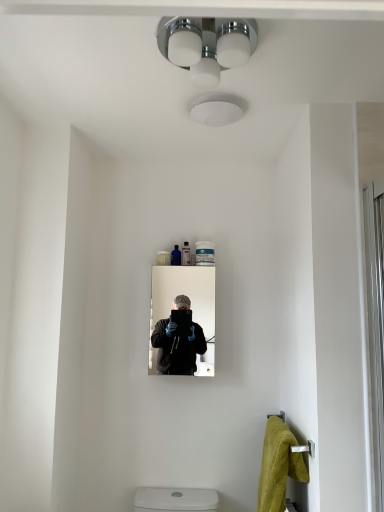
What do you see at coordinates (375, 329) in the screenshot? Image resolution: width=384 pixels, height=512 pixels. I see `white glossy screen door at right` at bounding box center [375, 329].

Find the location of `white glossy screen door at right`. white glossy screen door at right is located at coordinates (375, 329).

Measure the distance between point (295,443) and camera.

5.09 feet.

You are a GUI agent. You are given a task and a screenshot of the screen. Output one action in this format:
    pyautogui.click(x=<x>, y=<y>)
    Task: Click on the chrome/textured glass light fixture at upper center
    The width and height of the screenshot is (384, 512).
    Given the screenshot: What is the action you would take?
    coord(209,44)

The width and height of the screenshot is (384, 512). Identify the location of white glossy screen door at right. coord(375,329).

From a real-world perspective, is chrome/textured glass light fixture at upper center physically above yellow plush towel at lower right?

Result: Correct, in the physical world, chrome/textured glass light fixture at upper center is higher than yellow plush towel at lower right.

Would you consider chrome/textured glass light fixture at upper center to be distant from yellow plush towel at lower right?

That's right, there is a large distance between chrome/textured glass light fixture at upper center and yellow plush towel at lower right.

Considering the relative positions of chrome/textured glass light fixture at upper center and yellow plush towel at lower right in the image provided, is chrome/textured glass light fixture at upper center in front of yellow plush towel at lower right?

Yes, the depth of chrome/textured glass light fixture at upper center is less than that of yellow plush towel at lower right.

Considering the sizes of chrome/textured glass light fixture at upper center and yellow plush towel at lower right in the image, is chrome/textured glass light fixture at upper center bigger or smaller than yellow plush towel at lower right?

Clearly, chrome/textured glass light fixture at upper center is smaller in size than yellow plush towel at lower right.

Considering the relative sizes of translucent blue bottle at upper center, which appears as the 1th toiletry when viewed from the left, and yellow plush towel at lower right in the image provided, is translucent blue bottle at upper center, which appears as the 1th toiletry when viewed from the left, smaller than yellow plush towel at lower right?

Indeed, translucent blue bottle at upper center, which appears as the 1th toiletry when viewed from the left, has a smaller size compared to yellow plush towel at lower right.

From their relative heights in the image, would you say translucent blue bottle at upper center, the 2th toiletry positioned from the right, is taller or shorter than yellow plush towel at lower right?

In the image, translucent blue bottle at upper center, the 2th toiletry positioned from the right, appears to be shorter than yellow plush towel at lower right.

How many degrees apart are the facing directions of translucent blue bottle at upper center, the 2th toiletry positioned from the right, and yellow plush towel at lower right?

The facing directions of translucent blue bottle at upper center, the 2th toiletry positioned from the right, and yellow plush towel at lower right are 90.5 degrees apart.

Does translucent blue bottle at upper center, the 2th toiletry positioned from the right, come in front of yellow plush towel at lower right?

That is False.

Is translucent blue bottle at upper center, the 2th toiletry positioned from the right, positioned behind matte black mirror at center?

Yes, it is behind matte black mirror at center.

Considering the sizes of objects translucent blue bottle at upper center, the 2th toiletry positioned from the right, and matte black mirror at center in the image provided, who is taller, translucent blue bottle at upper center, the 2th toiletry positioned from the right, or matte black mirror at center?

Standing taller between the two is matte black mirror at center.

Considering the sizes of objects translucent blue bottle at upper center, which appears as the 1th toiletry when viewed from the left, and matte black mirror at center in the image provided, who is thinner, translucent blue bottle at upper center, which appears as the 1th toiletry when viewed from the left, or matte black mirror at center?

translucent blue bottle at upper center, which appears as the 1th toiletry when viewed from the left, is thinner.

Does translucent blue bottle at upper center, which appears as the 1th toiletry when viewed from the left, turn towards matte black mirror at center?

No, translucent blue bottle at upper center, which appears as the 1th toiletry when viewed from the left, is not oriented towards matte black mirror at center.

Between translucent blue bottle at upper center, which appears as the 1th toiletry when viewed from the left, and translucent plastic tube at center, the first toiletry from the right, which one has less height?

translucent blue bottle at upper center, which appears as the 1th toiletry when viewed from the left.

Considering the positions of objects translucent blue bottle at upper center, the 2th toiletry positioned from the right, and translucent plastic tube at center, the first toiletry from the right, in the image provided, who is more to the right, translucent blue bottle at upper center, the 2th toiletry positioned from the right, or translucent plastic tube at center, the first toiletry from the right,?

From the viewer's perspective, translucent plastic tube at center, the first toiletry from the right, appears more on the right side.

From the picture: From a real-world perspective, is translucent blue bottle at upper center, which appears as the 1th toiletry when viewed from the left, positioned above or below translucent plastic tube at center, which is the second toiletry from left to right?

translucent blue bottle at upper center, which appears as the 1th toiletry when viewed from the left, is situated lower than translucent plastic tube at center, which is the second toiletry from left to right, in the real world.

From the image's perspective, which object appears higher, white glossy screen door at right or yellow plush towel at lower right?

From the image's view, white glossy screen door at right is above.

Considering the positions of objects white glossy screen door at right and yellow plush towel at lower right in the image provided, who is behind, white glossy screen door at right or yellow plush towel at lower right?

Positioned behind is yellow plush towel at lower right.

Is white glossy screen door at right aimed at yellow plush towel at lower right?

No, white glossy screen door at right does not turn towards yellow plush towel at lower right.

Is yellow plush towel at lower right surrounded by white glossy screen door at right?

No, yellow plush towel at lower right is not surrounded by white glossy screen door at right.

Could translucent blue bottle at upper center, the 2th toiletry positioned from the right, be considered to be inside translucent plastic tube at center, which is the second toiletry from left to right?

No, translucent blue bottle at upper center, the 2th toiletry positioned from the right, is not surrounded by translucent plastic tube at center, which is the second toiletry from left to right.

Considering the sizes of objects translucent plastic tube at center, which is the second toiletry from left to right, and translucent blue bottle at upper center, the 2th toiletry positioned from the right, in the image provided, who is wider, translucent plastic tube at center, which is the second toiletry from left to right, or translucent blue bottle at upper center, the 2th toiletry positioned from the right,?

translucent blue bottle at upper center, the 2th toiletry positioned from the right, is wider.

Looking at this image, between translucent plastic tube at center, the first toiletry from the right, and translucent blue bottle at upper center, which appears as the 1th toiletry when viewed from the left, which one appears on the right side from the viewer's perspective?

translucent plastic tube at center, the first toiletry from the right, is more to the right.

Is translucent plastic tube at center, which is the second toiletry from left to right, further to camera compared to translucent blue bottle at upper center, which appears as the 1th toiletry when viewed from the left?

No.

Is point (240, 50) farther from camera compared to point (373, 422)?

No, (240, 50) is in front of (373, 422).

From their relative heights in the image, would you say chrome/textured glass light fixture at upper center is taller or shorter than white glossy screen door at right?

chrome/textured glass light fixture at upper center is shorter than white glossy screen door at right.

Is chrome/textured glass light fixture at upper center spatially inside white glossy screen door at right, or outside of it?

chrome/textured glass light fixture at upper center is outside white glossy screen door at right.

Considering the relative sizes of chrome/textured glass light fixture at upper center and white glossy screen door at right in the image provided, is chrome/textured glass light fixture at upper center bigger than white glossy screen door at right?

No.

Locate an element on the screen. This screenshot has height=512, width=384. bath towel below the chrome/textured glass light fixture at upper center (from the image's perspective) is located at coordinates (278, 466).

This screenshot has width=384, height=512. Find the location of `bath towel that is on the right side of translucent blue bottle at upper center, which appears as the 1th toiletry when viewed from the left`. bath towel that is on the right side of translucent blue bottle at upper center, which appears as the 1th toiletry when viewed from the left is located at coordinates (278, 466).

From the image, which object appears to be farther from chrome/textured glass light fixture at upper center, translucent blue bottle at upper center, which appears as the 1th toiletry when viewed from the left, or yellow plush towel at lower right?

yellow plush towel at lower right is further to chrome/textured glass light fixture at upper center.

Estimate the real-world distances between objects in this image. Which object is closer to white glossy screen door at right, translucent blue bottle at upper center, the 2th toiletry positioned from the right, or chrome/textured glass light fixture at upper center?

Among the two, chrome/textured glass light fixture at upper center is located nearer to white glossy screen door at right.

Which object lies further to the anchor point yellow plush towel at lower right, white glossy screen door at right or translucent blue bottle at upper center, which appears as the 1th toiletry when viewed from the left?

translucent blue bottle at upper center, which appears as the 1th toiletry when viewed from the left, lies further to yellow plush towel at lower right than the other object.

Looking at the image, which one is located further to chrome/textured glass light fixture at upper center, translucent plastic tube at center, the first toiletry from the right, or translucent blue bottle at upper center, which appears as the 1th toiletry when viewed from the left?

translucent blue bottle at upper center, which appears as the 1th toiletry when viewed from the left, lies further to chrome/textured glass light fixture at upper center than the other object.

Looking at the image, which one is located closer to translucent plastic tube at center, the first toiletry from the right, white glossy screen door at right or yellow plush towel at lower right?

yellow plush towel at lower right lies closer to translucent plastic tube at center, the first toiletry from the right, than the other object.

Estimate the real-world distances between objects in this image. Which object is closer to white glossy screen door at right, translucent blue bottle at upper center, the 2th toiletry positioned from the right, or yellow plush towel at lower right?

Based on the image, yellow plush towel at lower right appears to be nearer to white glossy screen door at right.

Looking at the image, which one is located closer to matte black mirror at center, chrome/textured glass light fixture at upper center or translucent plastic tube at center, which is the second toiletry from left to right?

Among the two, translucent plastic tube at center, which is the second toiletry from left to right, is located nearer to matte black mirror at center.

Considering their positions, is translucent plastic tube at center, which is the second toiletry from left to right, positioned further to white glossy screen door at right than yellow plush towel at lower right?

translucent plastic tube at center, which is the second toiletry from left to right, is further to white glossy screen door at right.

I want to click on screen door positioned between chrome/textured glass light fixture at upper center and translucent plastic tube at center, which is the second toiletry from left to right, from near to far, so click(375, 329).

At what (x,y) coordinates should I click in order to perform the action: click on screen door between chrome/textured glass light fixture at upper center and yellow plush towel at lower right in the up-down direction. Please return your answer as a coordinate pair (x, y). This screenshot has height=512, width=384. Looking at the image, I should click on (375, 329).

Find the location of a particular element. Image resolution: width=384 pixels, height=512 pixels. mirror between chrome/textured glass light fixture at upper center and yellow plush towel at lower right vertically is located at coordinates [x=192, y=318].

Identify the location of bath towel between matte black mirror at center and white glossy screen door at right from left to right. Image resolution: width=384 pixels, height=512 pixels. (278, 466).